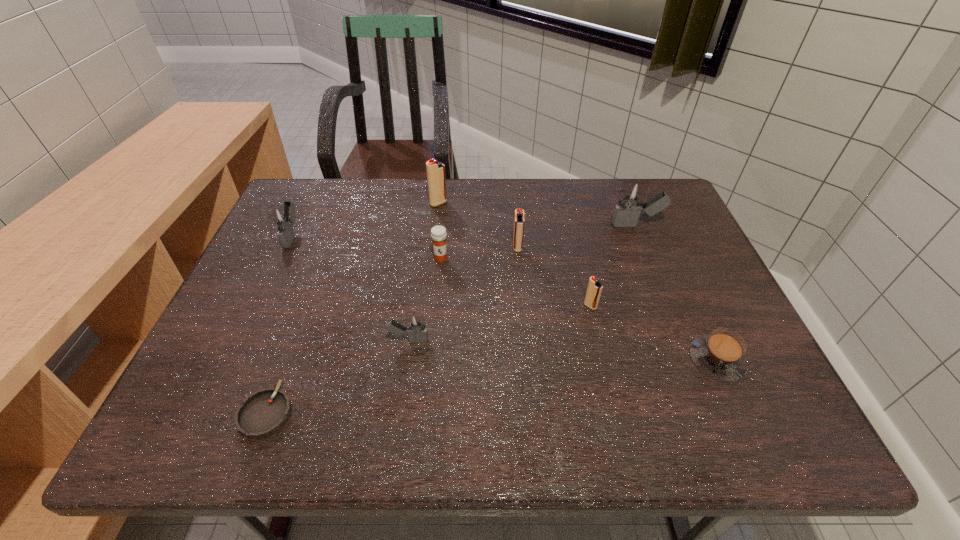
Identify the location of the farthest object. This screenshot has width=960, height=540. (436, 179).

Where is `the farthest igniter`? The height and width of the screenshot is (540, 960). the farthest igniter is located at coordinates (436, 179).

Image resolution: width=960 pixels, height=540 pixels. What are the coordinates of `the rightmost gray igniter` in the screenshot? It's located at (631, 198).

Identify the location of the biggest gray igniter. (631, 198).

This screenshot has width=960, height=540. I want to click on the leftmost object, so click(x=282, y=217).

You are a GUI agent. You are given a task and a screenshot of the screen. Output one action in this format:
    pyautogui.click(x=<x>, y=<y>)
    Task: Click on the second smallest gray igniter
    The width and height of the screenshot is (960, 540).
    Given the screenshot: What is the action you would take?
    pyautogui.click(x=282, y=217)

Locate an element on the screen. The height and width of the screenshot is (540, 960). the second biggest red igniter is located at coordinates (519, 221).

In order to click on the sixth object from left to right in this screenshot , I will do `click(519, 221)`.

This screenshot has height=540, width=960. What are the coordinates of `the fifth farthest object` in the screenshot? It's located at (438, 233).

This screenshot has width=960, height=540. Find the location of `the fourth nearest object`. the fourth nearest object is located at coordinates (594, 289).